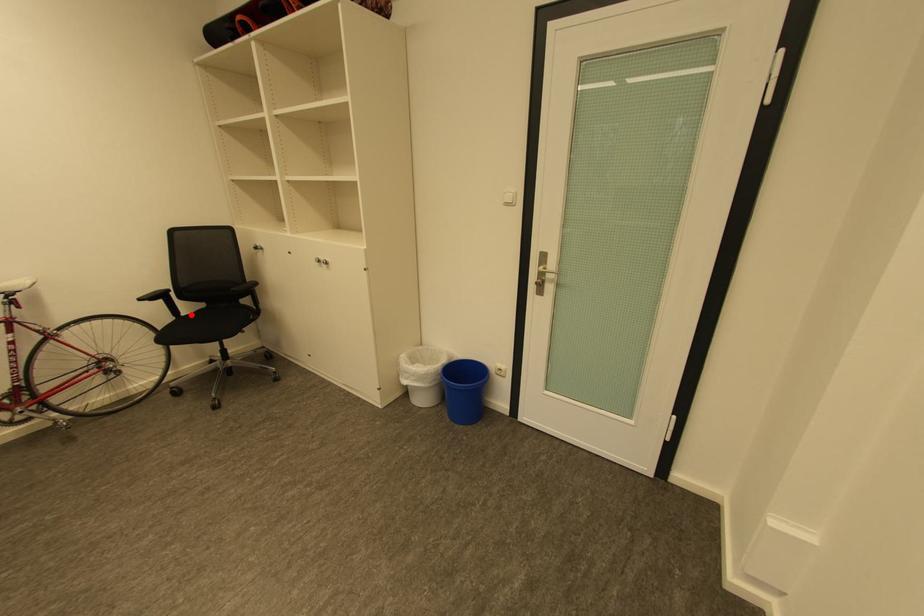
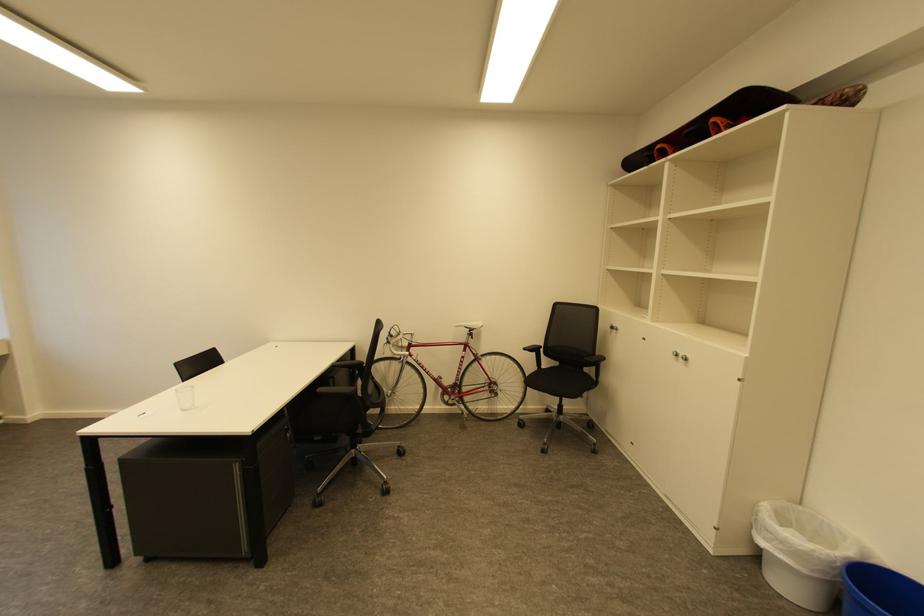
Question: I am providing you with two images of the same scene from different viewpoints. A red point is marked on the first image. At the location where the point appears in image 1, is it still visible in image 2?

Choices:
 (A) Yes
 (B) No

Answer: (A)